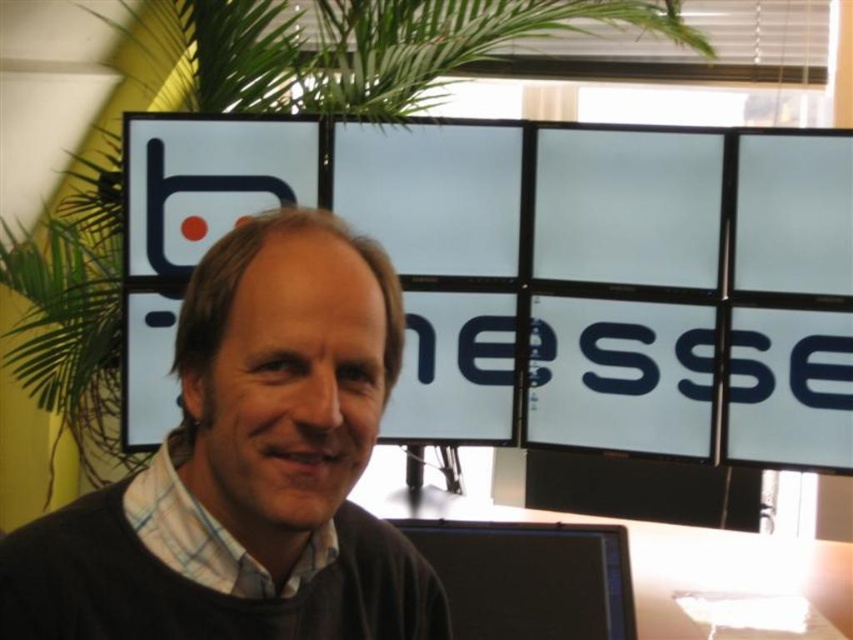
Question: Is dark brown sweater at center to the left of black glossy monitor at lower center from the viewer's perspective?

Choices:
 (A) yes
 (B) no

Answer: (A)

Question: From the image, what is the correct spatial relationship of dark brown sweater at center in relation to black glossy monitor at lower center?

Choices:
 (A) above
 (B) below

Answer: (A)

Question: Is dark brown sweater at center positioned behind black glossy monitor at lower center?

Choices:
 (A) yes
 (B) no

Answer: (B)

Question: Which point is farther to the camera?

Choices:
 (A) dark brown sweater at center
 (B) black glossy monitor at lower center

Answer: (B)

Question: Which of the following is the closest to the observer?

Choices:
 (A) (198, 413)
 (B) (584, 538)

Answer: (A)